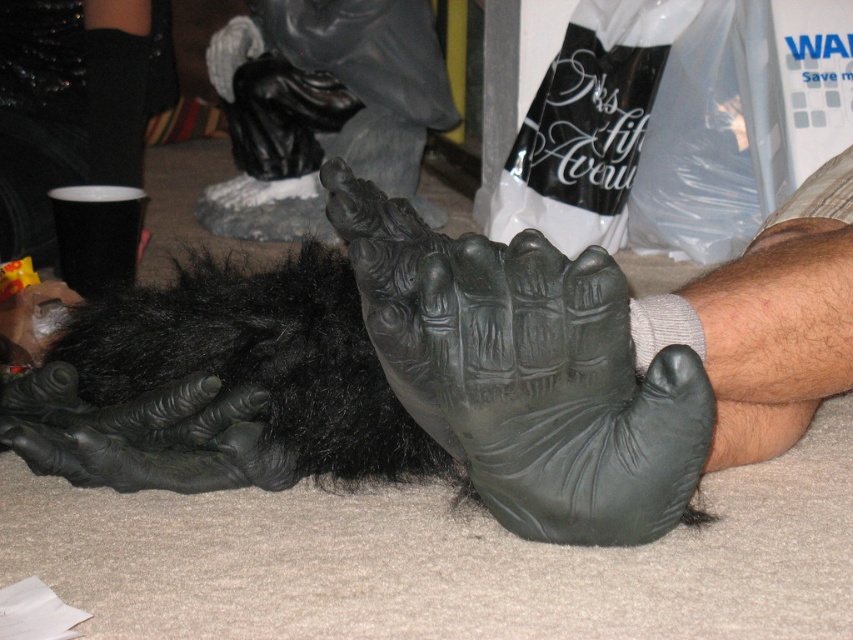
Is point (345, 179) in front of point (286, 452)?

Yes, point (345, 179) is closer to viewer.

The width and height of the screenshot is (853, 640). Find the location of `rubber-like black hand at center`. rubber-like black hand at center is located at coordinates (527, 372).